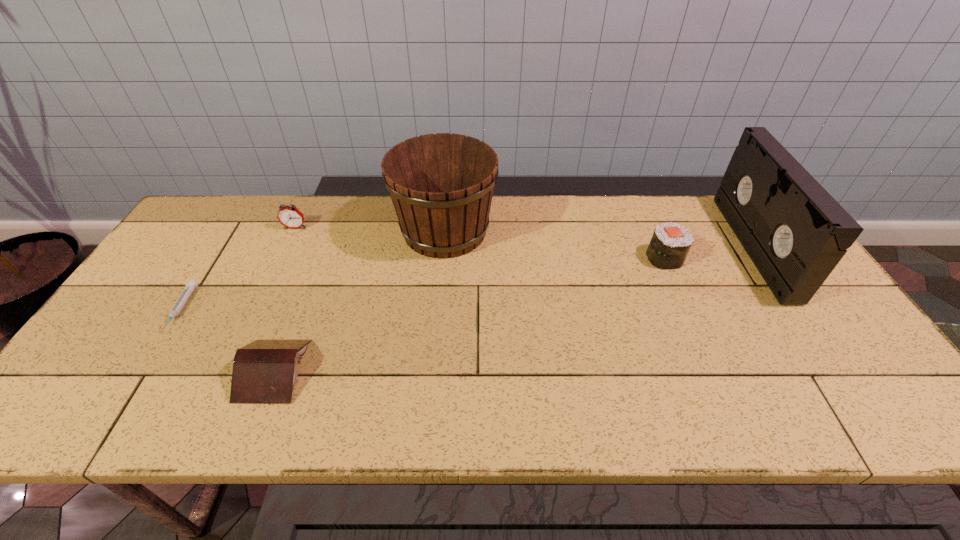
I want to click on free point located on the side of the videotape with visible spindles, so pos(649,247).

I want to click on vacant space located 0.070m on the right of the fourth object from left to right, so click(518, 231).

At what (x,y) coordinates should I click in order to perform the action: click on free space located on the back of the sushi. Please return your answer as a coordinate pair (x, y). Image resolution: width=960 pixels, height=540 pixels. Looking at the image, I should click on (644, 210).

Identify the location of free space located 0.300m on the clock face of the alarm clock. (259, 302).

What are the coordinates of `free space located on the right of the nearest object` in the screenshot? It's located at (390, 370).

I want to click on vacant space positioned at the needle end of the leftmost object, so click(x=122, y=402).

Where is `videotape present at the far edge`? Image resolution: width=960 pixels, height=540 pixels. videotape present at the far edge is located at coordinates (794, 231).

At what (x,y) coordinates should I click in order to perform the action: click on wine bucket at the far edge. Please return your answer as a coordinate pair (x, y). This screenshot has height=540, width=960. Looking at the image, I should click on (441, 185).

This screenshot has width=960, height=540. I want to click on alarm clock that is at the far edge, so coord(289,216).

You are a GUI agent. You are given a task and a screenshot of the screen. Output one action in this format:
    pyautogui.click(x=<x>, y=<y>)
    Task: Click on the object located in the near edge section of the desktop
    Image resolution: width=960 pixels, height=540 pixels.
    Given the screenshot: What is the action you would take?
    pyautogui.click(x=264, y=371)